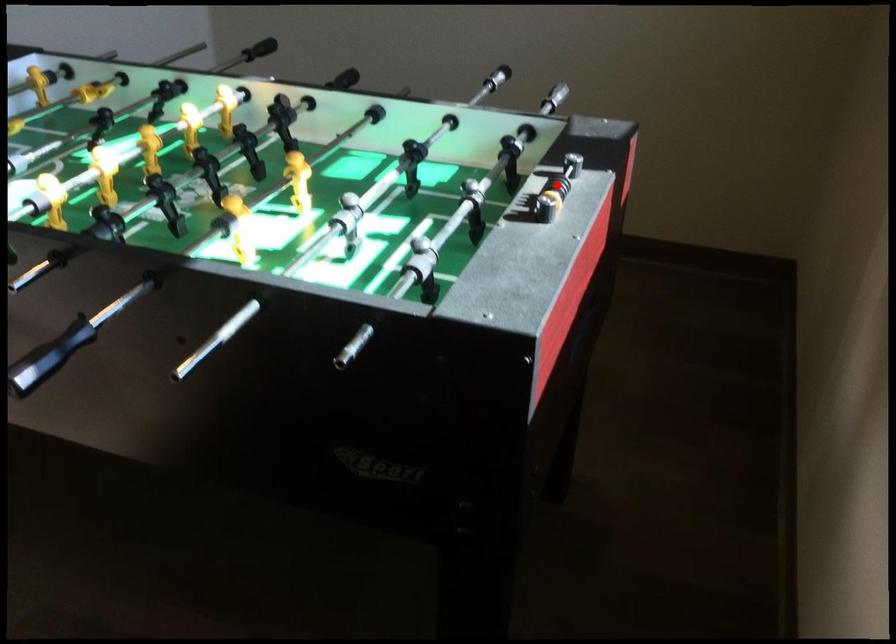
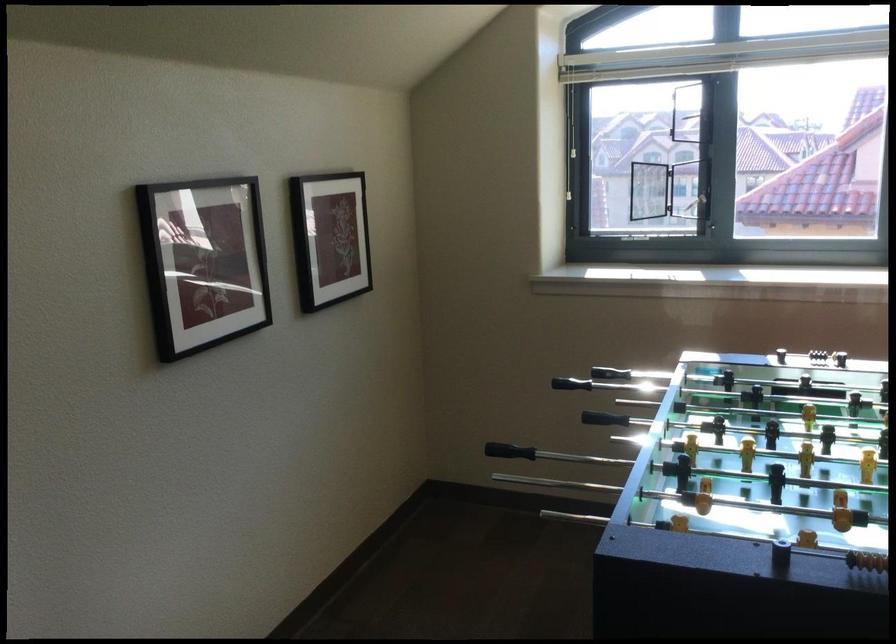
In the second image, find the point that corresponds to the highlighted location in the first image.

(814, 352)